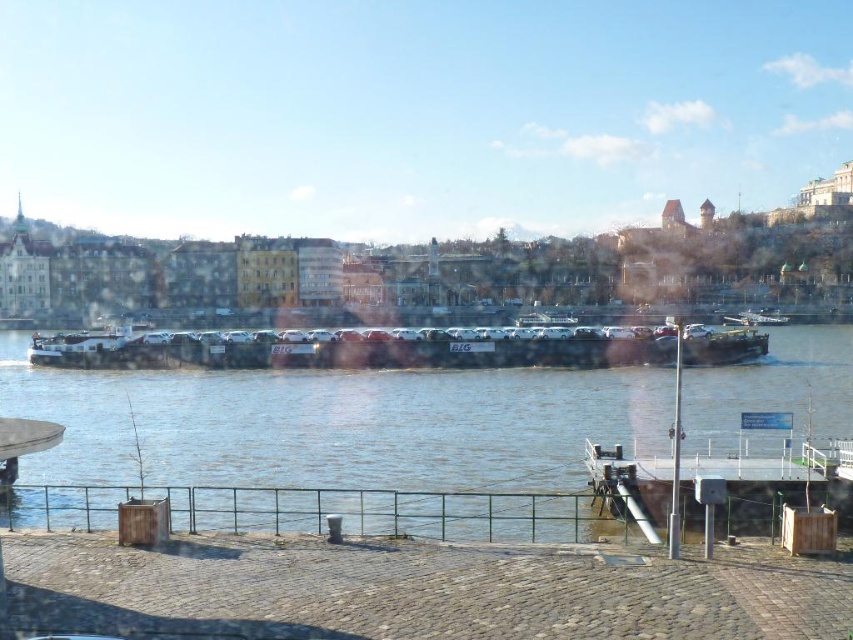
You are a delivery driver who needs to cross the river to deliver cars. You see the brown matte water at center and the metallic gray barge at center. Which object should you use to cross the river safely?

You should use the metallic gray barge at center to cross the river safely because it is designed to transport vehicles like cars, while the brown matte water at center is just the river surface and cannot support the weight of a car.

You are a photographer planning to capture the entire view of the metallic gray barge at center and the brown matte water at center in a single shot. Given that your camera can only fit objects within a 10 meter width, can both objects fit side by side?

The brown matte water at center is wider than the metallic gray barge at center. Since the camera can only fit objects within a 10 meter width, it depends on the combined width of both objects. However, the description only provides a comparison between their widths, not their exact measurements. Without knowing the individual widths, it is impossible to determine if they can fit side by side within the 10 meter limit.